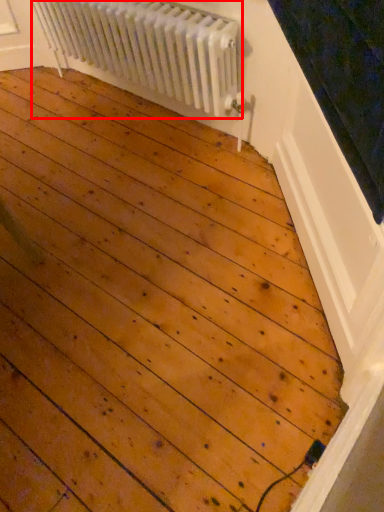
Question: From the image's perspective, what is the correct spatial relationship of radiator (annotated by the red box) in relation to window sill?

Choices:
 (A) above
 (B) below

Answer: (A)